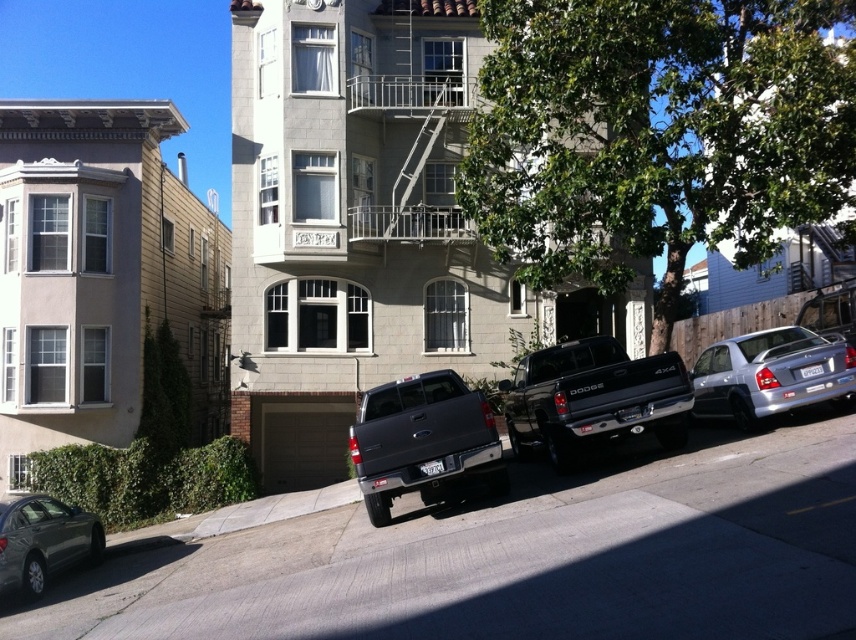
You are a delivery person who needs to back out of the parking spot between the black matte truck at center and the silver metallic sedan at right. Which vehicle should you move around to exit safely?

The black matte truck at center is in front of the silver metallic sedan at right, so you should move around the silver metallic sedan at right to exit safely since it is behind you.